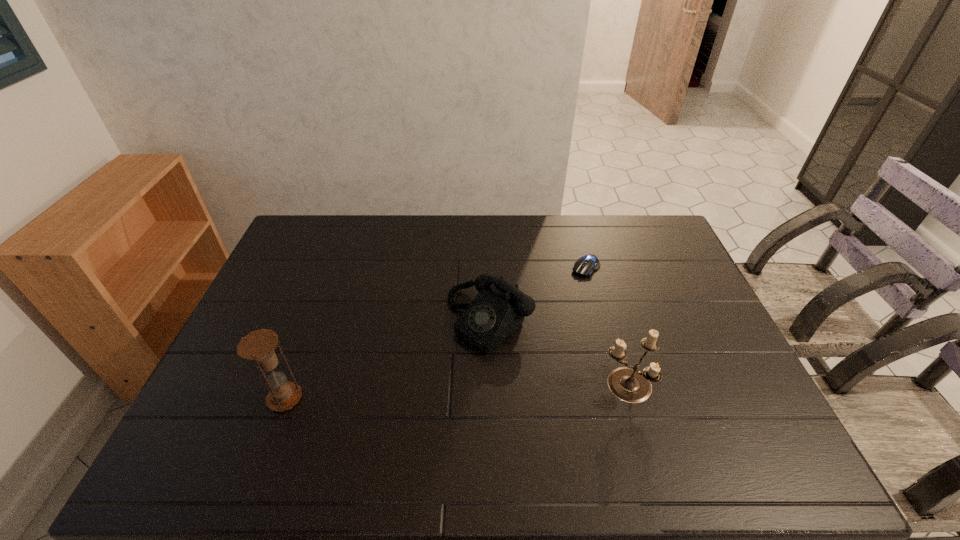
Find the location of a particular element. The width and height of the screenshot is (960, 540). free spot between the candle holder and the farthest object is located at coordinates (607, 327).

Locate an element on the screen. The image size is (960, 540). free space between the third nearest object and the tallest object is located at coordinates (387, 359).

Image resolution: width=960 pixels, height=540 pixels. What are the coordinates of `free space between the candle holder and the leftmost object` in the screenshot? It's located at (456, 392).

In order to click on object that stands as the second closest to the farthest object in this screenshot , I will do `click(627, 383)`.

Find the location of a particular element. the third closest object to the tallest object is located at coordinates (584, 266).

Where is `free space that satisfies the following two spatial constraints: 1. on the back side of the second tallest object; 2. on the right side of the hourglass`? This screenshot has width=960, height=540. free space that satisfies the following two spatial constraints: 1. on the back side of the second tallest object; 2. on the right side of the hourglass is located at coordinates (289, 386).

At what (x,y) coordinates should I click in order to perform the action: click on free space that satisfies the following two spatial constraints: 1. on the front side of the farthest object; 2. on the right side of the candle holder. Please return your answer as a coordinate pair (x, y). The width and height of the screenshot is (960, 540). Looking at the image, I should click on (618, 386).